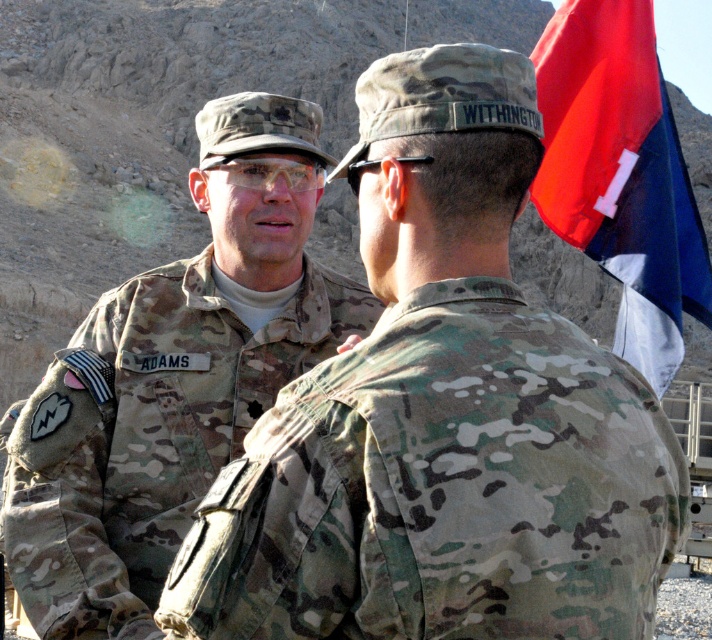
Looking at this image, you are a photographer trying to capture a group photo of the two people in the scene. Since the camouflage uniform at left and the red fabric flag at upper right are in different sizes, which one should you move closer to the camera to make them appear the same size in the photo?

To make the camouflage uniform at left and the red fabric flag at upper right appear the same size in the photo, you should move the camouflage uniform at left closer to the camera since it is currently smaller than the red fabric flag at upper right.

You are a photographer trying to capture a group photo of two soldiers. You notice that the camouflage uniform at left and the camouflage fabric uniform at left have different heights. Which soldier should you ask to adjust their posture to ensure both are at the same height in the photo?

The camouflage uniform at left is taller than the camouflage fabric uniform at left. To ensure both soldiers are at the same height in the photo, the soldier in the camouflage fabric uniform at left should adjust their posture by standing taller or the other soldier should lower their stance slightly.

You are a photographer trying to capture a clear photo of the two soldiers. The camouflage uniform at left and the camouflage fabric uniform at left are both in the frame. Which one is covering the other?

The camouflage uniform at left is positioned over camouflage fabric uniform at left, so it is covering the latter.